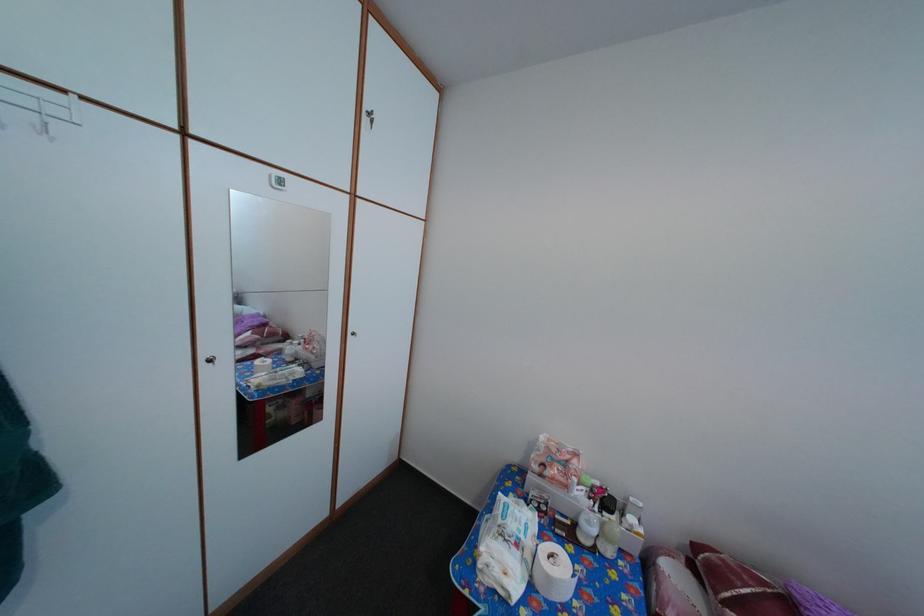
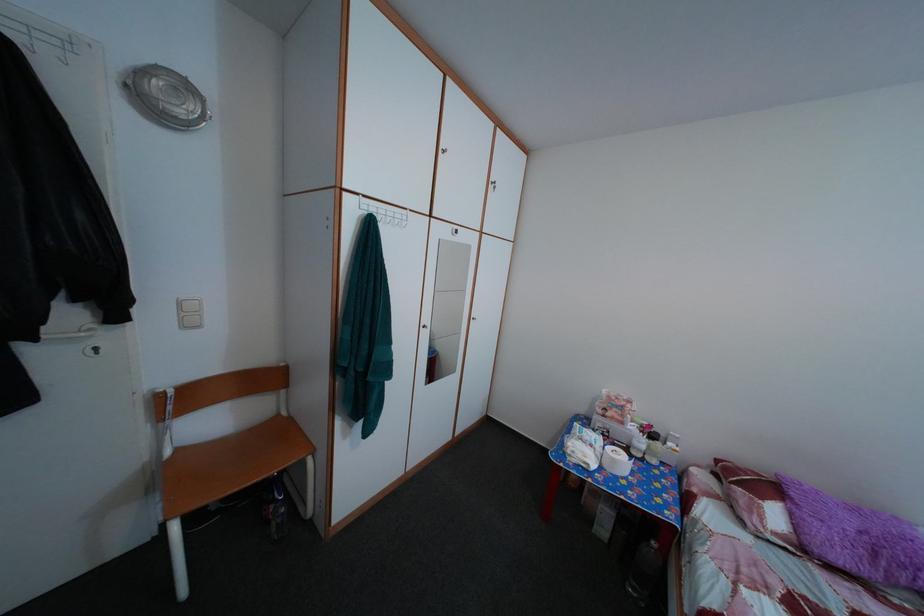
Which direction would the cameraman need to move to produce the second image?

The movement direction of the cameraman is left, backward.